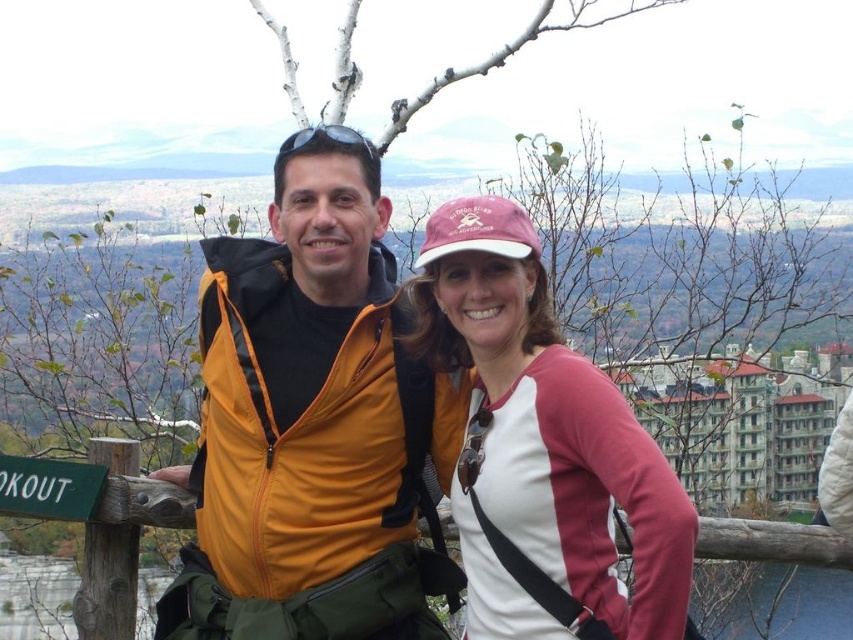
Question: Can you confirm if yellow softshell jacket at center is wider than pink fabric baseball cap at upper center?

Choices:
 (A) no
 (B) yes

Answer: (B)

Question: Can you confirm if pink fabric baseball cap at upper center is thinner than green wood sign at lower left?

Choices:
 (A) yes
 (B) no

Answer: (B)

Question: Does yellow softshell jacket at center have a smaller size compared to green wood sign at lower left?

Choices:
 (A) no
 (B) yes

Answer: (A)

Question: Which point appears closest to the camera in this image?

Choices:
 (A) (299, 448)
 (B) (485, 596)

Answer: (A)

Question: Which of the following is the closest to the observer?

Choices:
 (A) yellow softshell jacket at center
 (B) pink fabric baseball cap at upper center
 (C) green wood sign at lower left

Answer: (B)

Question: Which of the following is the closest to the observer?

Choices:
 (A) (527, 525)
 (B) (386, 284)
 (C) (22, 483)

Answer: (A)